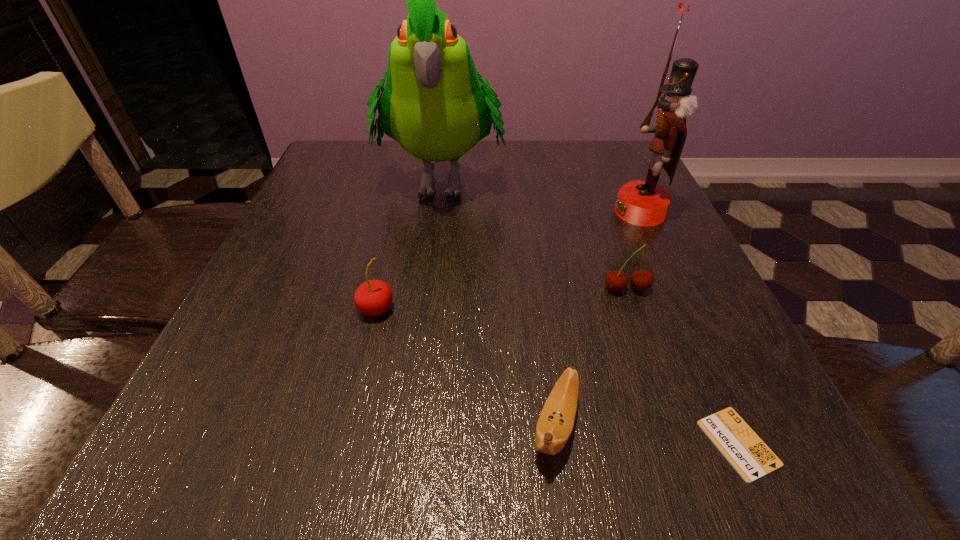
You are a GUI agent. You are given a task and a screenshot of the screen. Output one action in this format:
    pyautogui.click(x=<x>, y=<y>)
    Task: Click on the free space located 0.290m on the front-facing side of the nutcracker
    This screenshot has height=540, width=960.
    Given the screenshot: What is the action you would take?
    pyautogui.click(x=480, y=212)

At what (x,y) coordinates should I click in order to perform the action: click on vacant region located on the back of the left cherry. Please return your answer as a coordinate pair (x, y). This screenshot has height=540, width=960. Looking at the image, I should click on (400, 205).

Locate an element on the screen. The height and width of the screenshot is (540, 960). vacant space located 0.150m on the surface of the right cherry is located at coordinates [655, 370].

The width and height of the screenshot is (960, 540). What are the coordinates of `vacant space located 0.170m on the left of the banana` in the screenshot? It's located at coord(401,424).

Locate an element on the screen. Image resolution: width=960 pixels, height=540 pixels. vacant space located on the left of the shortest object is located at coordinates (394, 443).

What are the coordinates of `object that is at the far edge` in the screenshot? It's located at (433, 104).

Locate an element on the screen. The height and width of the screenshot is (540, 960). banana that is at the near edge is located at coordinates (556, 421).

At what (x,y) coordinates should I click in order to perform the action: click on identity card that is at the near edge. Please return your answer as a coordinate pair (x, y). The image size is (960, 540). Looking at the image, I should click on (741, 446).

Where is `nutcracker situated at the right edge`? The image size is (960, 540). nutcracker situated at the right edge is located at coordinates (646, 203).

Locate an element on the screen. This screenshot has height=540, width=960. cherry located at the right edge is located at coordinates (616, 281).